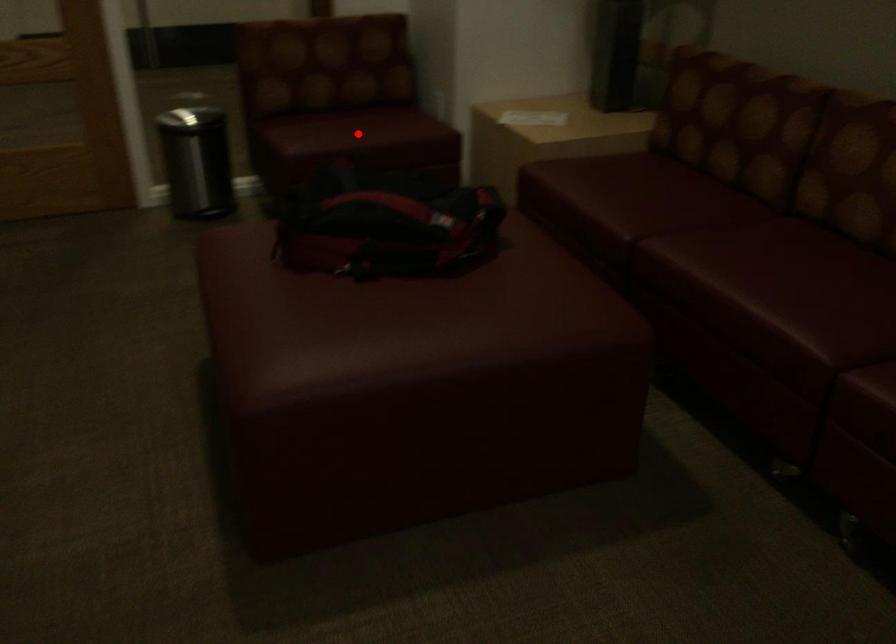
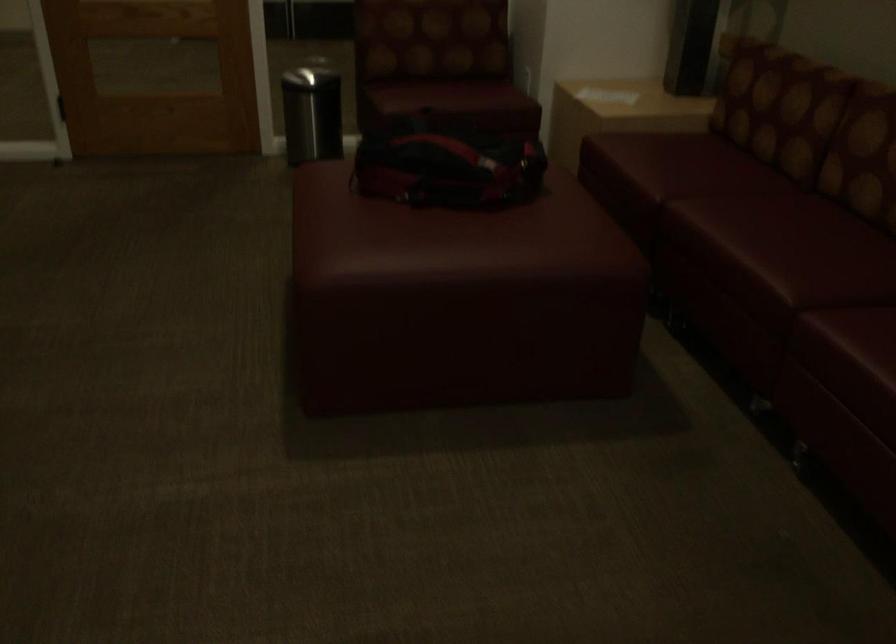
Where in the second image is the point corresponding to the highlighted location from the first image?

(448, 96)